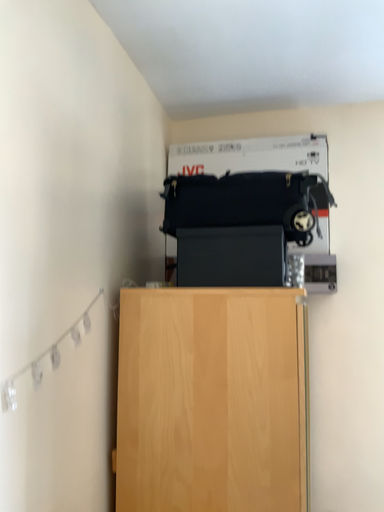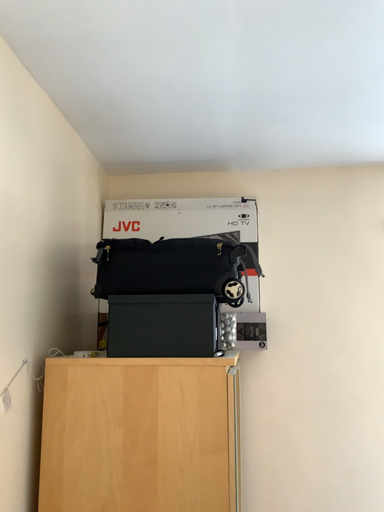
Question: How did the camera likely rotate when shooting the video?

Choices:
 (A) rotated left
 (B) rotated right

Answer: (B)